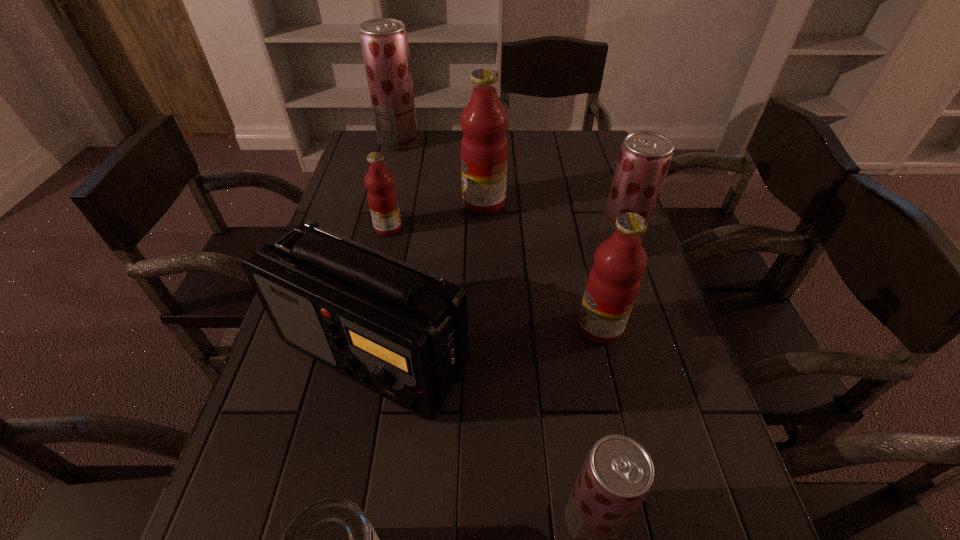
You are a GUI agent. You are given a task and a screenshot of the screen. Output one action in this format:
    pyautogui.click(x=<x>, y=<y>)
    Task: Click on the smallest pink fruit juice
    The image size is (960, 540).
    Given the screenshot: What is the action you would take?
    pyautogui.click(x=382, y=197)

Image resolution: width=960 pixels, height=540 pixels. Find the location of `free region located on the front of the farthest fruit juice`. free region located on the front of the farthest fruit juice is located at coordinates (389, 179).

In order to click on free space located 0.260m on the label of the farthest pink fruit juice in this screenshot , I will do `click(374, 202)`.

Locate an element on the screen. vacant space located 0.220m on the label of the farthest pink fruit juice is located at coordinates (388, 202).

The width and height of the screenshot is (960, 540). What are the coordinates of `free region located on the label of the farthest pink fruit juice` in the screenshot? It's located at (350, 202).

You are a GUI agent. You are given a task and a screenshot of the screen. Output one action in this format:
    pyautogui.click(x=<x>, y=<y>)
    Task: Click on the vacant space situated 0.210m on the left of the rightmost strawberry fruit juice
    
    Given the screenshot: What is the action you would take?
    pyautogui.click(x=518, y=245)

Locate an element on the screen. vacant area situated on the label of the nearest pink fruit juice is located at coordinates (510, 327).

Where is `vacant space located 0.280m on the label of the nearest pink fruit juice`? vacant space located 0.280m on the label of the nearest pink fruit juice is located at coordinates (451, 327).

This screenshot has height=540, width=960. Identify the location of vacant area located on the label of the nearest pink fruit juice. (433, 327).

You are a GUI agent. You are given a task and a screenshot of the screen. Output one action in this format:
    pyautogui.click(x=<x>, y=<y>)
    Task: Click on the vacant space positioned 0.170m on the front panel of the radio receiver
    The height and width of the screenshot is (540, 960).
    Given the screenshot: What is the action you would take?
    pyautogui.click(x=340, y=525)